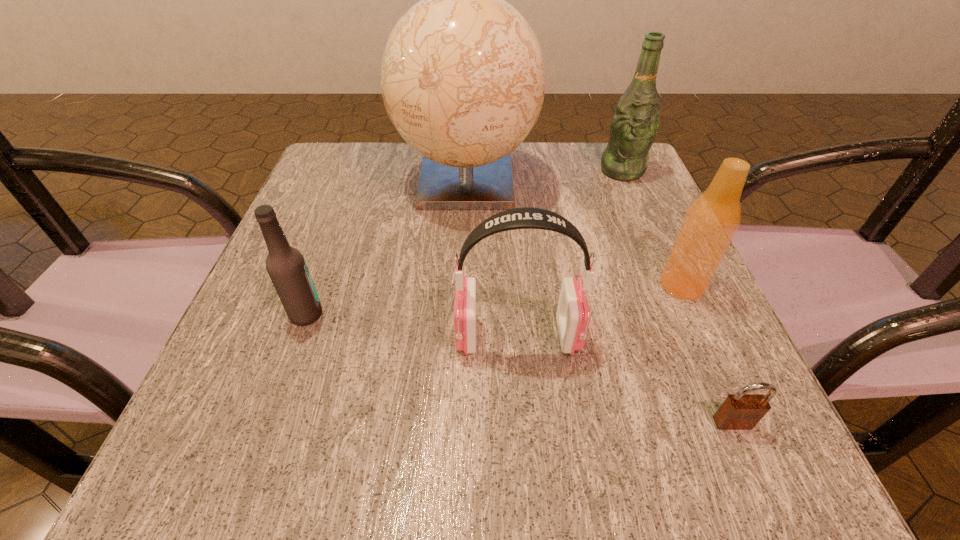
Where is `the tallest object`? the tallest object is located at coordinates (463, 76).

Find the location of a particular element. the tallest beer bottle is located at coordinates (635, 123).

In order to click on the farthest beer bottle in this screenshot , I will do `click(635, 123)`.

Identify the location of the second farthest beer bottle. (711, 221).

Identify the location of earphone. (573, 315).

Locate an element on the screen. the leftmost beer bottle is located at coordinates (286, 266).

Find the location of a particular element. The height and width of the screenshot is (540, 960). the nearest beer bottle is located at coordinates (286, 266).

Where is `the shortest object`? The height and width of the screenshot is (540, 960). the shortest object is located at coordinates (740, 411).

You are a GUI agent. You are given a task and a screenshot of the screen. Output one action in this format:
    pyautogui.click(x=<x>, y=<y>)
    Task: Click on the padlock
    The image size is (960, 540).
    Given the screenshot: What is the action you would take?
    pyautogui.click(x=740, y=411)

Identify the location of vacant space located on the surface of the tallest object showing Europe and Africa. This screenshot has height=540, width=960. (462, 293).